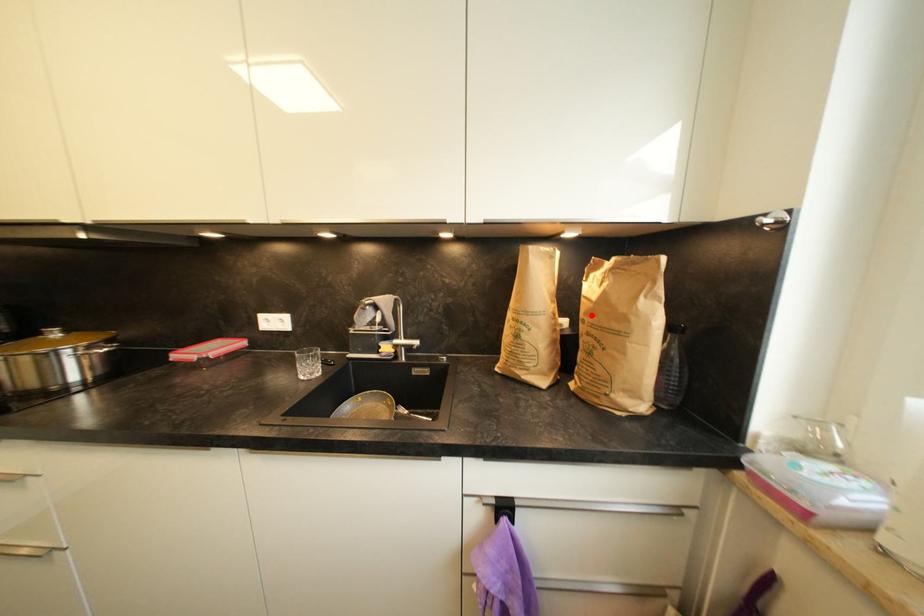
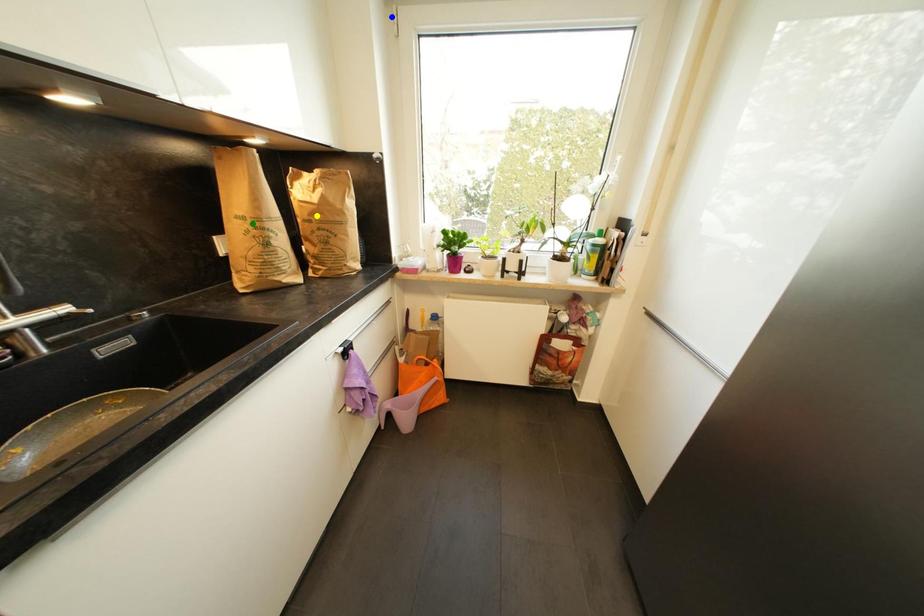
Question: I am providing you with two images of the same scene from different viewpoints. A red point is marked on the first image. You are given multiple points on the second image. Can you choose the point in image 2 that corresponds to the point in image 1?

Choices:
 (A) blue point
 (B) green point
 (C) yellow point

Answer: (C)